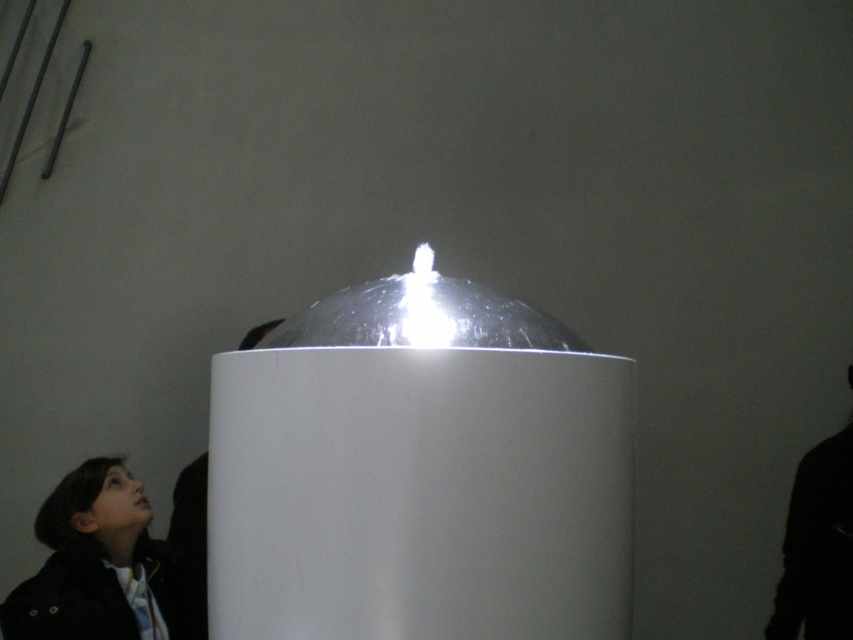
From the picture: You are a delivery robot that needs to drop off a package to the transparent plastic dome at center. You are currently at the position of the black fabric jacket at lower left. Can you reach the dome without moving closer than 20 inches?

The distance between the transparent plastic dome at center and the black fabric jacket at lower left is 21.92 inches, so yes, the robot can reach the dome without moving closer than 20 inches since the existing distance is sufficient.

You are a photographer setting up a shoot in this room. You need to place a tripod between the black matte jacket at right and the black matte man at lower left. Which object should the tripod be closer to if you want it to be placed at the same height level as the taller object?

The black matte jacket at right is taller than the black matte man at lower left. To place the tripod at the same height as the taller object, position it closer to the black matte jacket at right.

You are organizing a photo shoot and need to place two black matte objects in the scene. The objects are the black matte jacket at right and the black matte man at lower left. Which object has a smaller width?

The black matte jacket at right is thinner than the black matte man at lower left, so the black matte jacket at right has a smaller width.